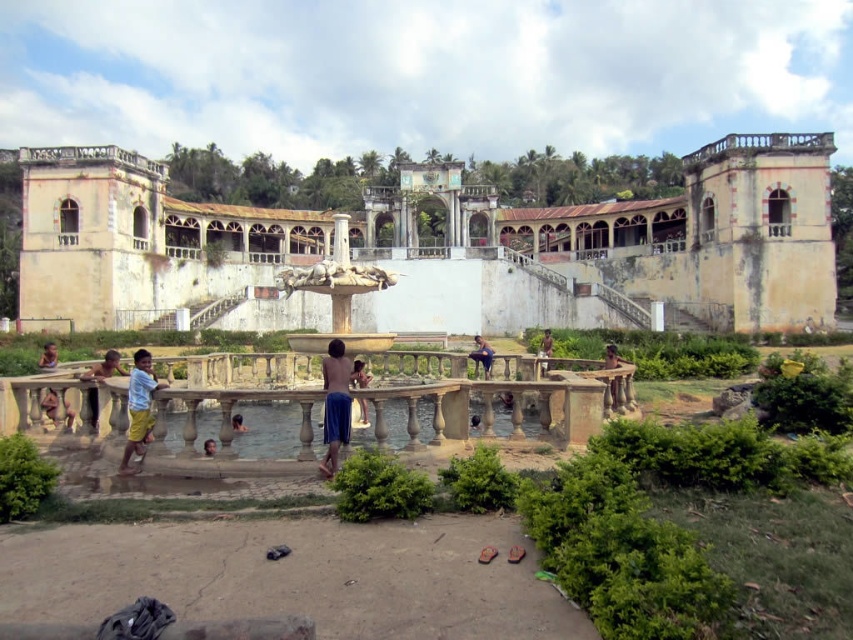
Looking at this image, does clear water at center appear on the right side of blue fabric shorts at center?

Yes, clear water at center is to the right of blue fabric shorts at center.

Where is `clear water at center`? clear water at center is located at coordinates (267, 429).

At what (x,y) coordinates should I click in order to perform the action: click on clear water at center. Please return your answer as a coordinate pair (x, y). The image size is (853, 640). Looking at the image, I should click on (267, 429).

Between point (780, 228) and point (474, 342), which one is positioned behind?

The point (474, 342) is behind.

Is point (381, 204) in front of point (479, 339)?

That is False.

Which is behind, point (163, 301) or point (480, 337)?

Point (480, 337)

Where is `white weathered palace at center`? The height and width of the screenshot is (640, 853). white weathered palace at center is located at coordinates (437, 246).

At what (x,y) coordinates should I click in order to perform the action: click on light blue fabric shorts at lower left. Please return your answer as a coordinate pair (x, y). The height and width of the screenshot is (640, 853). Looking at the image, I should click on (x=105, y=365).

Is light blue fabric shorts at lower left further to camera compared to dark skin human at center?

That is False.

Between point (109, 355) and point (242, 428), which one is positioned behind?

Point (242, 428)

The height and width of the screenshot is (640, 853). What are the coordinates of `light blue fabric shorts at lower left` in the screenshot? It's located at (105, 365).